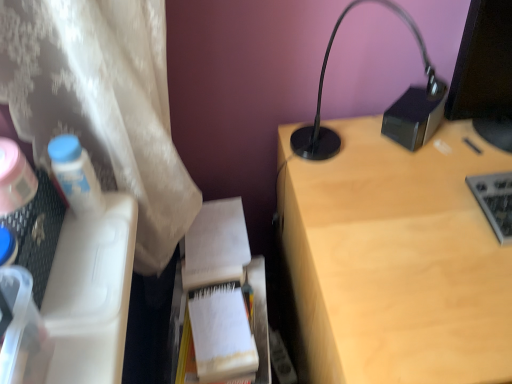
You are a GUI agent. You are given a task and a screenshot of the screen. Output one action in this format:
    pyautogui.click(x=<x>, y=<y>)
    Task: Click on the vacant space in white paper notebook at center (from a real-world perspective)
    The height and width of the screenshot is (384, 512).
    Given the screenshot: What is the action you would take?
    pyautogui.click(x=215, y=231)